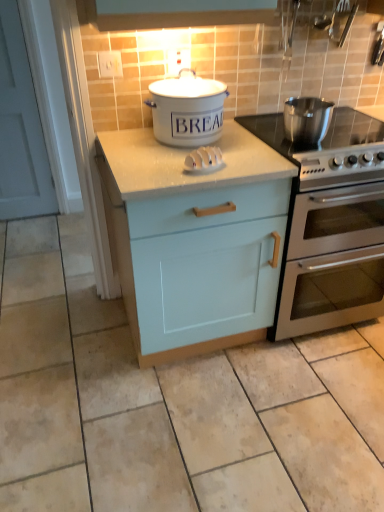
Find the location of `vacant space underneath polished stainless steel pot at right, acting as the second kitchen appliance starting from the left (from a real-world perspective)`. vacant space underneath polished stainless steel pot at right, acting as the second kitchen appliance starting from the left (from a real-world perspective) is located at coordinates (302, 140).